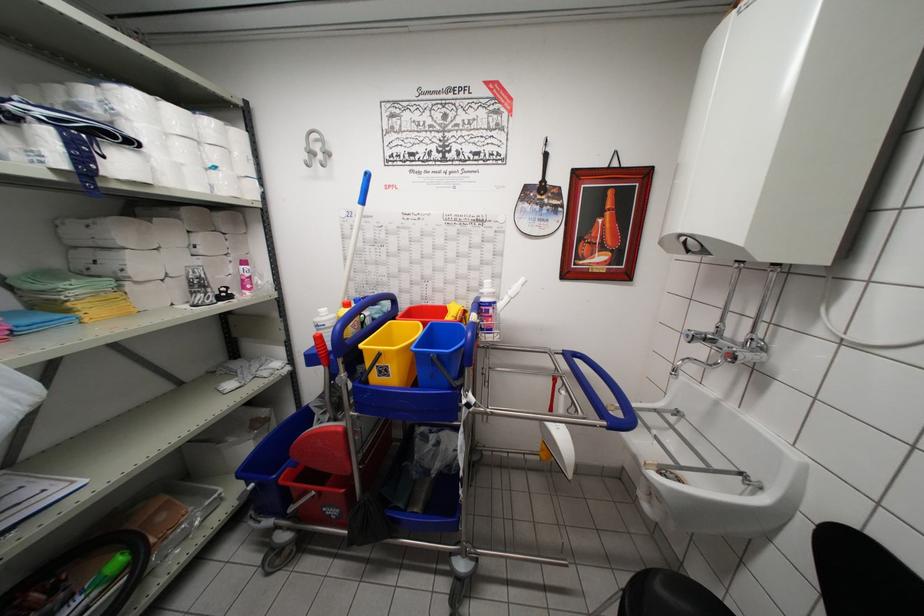
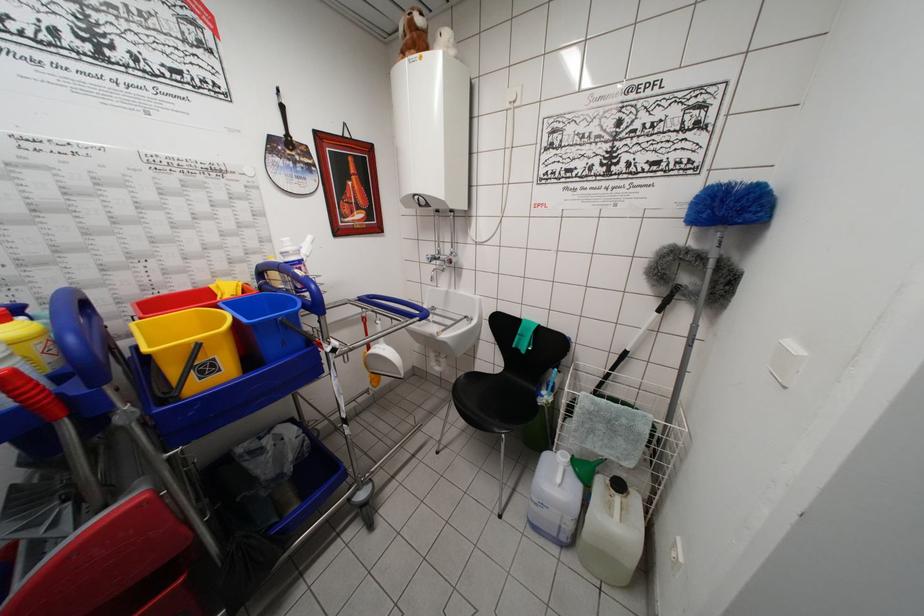
Locate, in the second image, the point that corresponds to point 690,339 in the first image.

(432, 262)